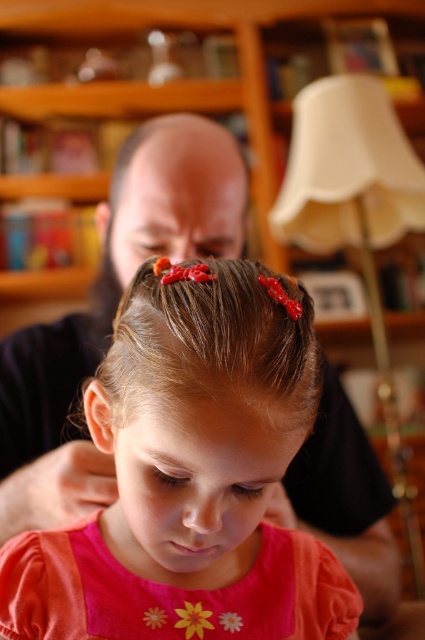
Who is more forward, (238, 385) or (108, 269)?

Point (238, 385)

Between point (241, 392) and point (108, 310), which one is positioned behind?

The point (108, 310) is more distant.

Identify the location of shiny orange barrette at center. (214, 342).

Find the location of a particular element. The image size is (425, 640). shiny orange barrette at center is located at coordinates (214, 342).

Which of these two, pink satin dress at center or brown shiny hair at center, stands taller?

With more height is pink satin dress at center.

Is point (272, 561) positioned behind point (95, 288)?

That is False.

Locate an element on the screen. pink satin dress at center is located at coordinates (190, 474).

Can you confirm if pink satin dress at center is wider than shiny orange barrette at center?

Yes, pink satin dress at center is wider than shiny orange barrette at center.

Does pink satin dress at center have a lesser width compared to shiny orange barrette at center?

No.

Does point (266, 541) come closer to viewer compared to point (190, 317)?

No, (266, 541) is further to viewer.

Find the location of a particular element. pink satin dress at center is located at coordinates (190, 474).